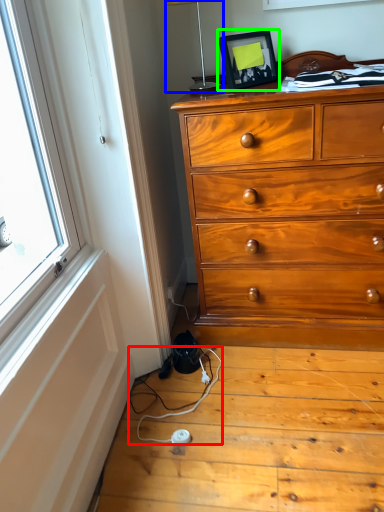
Question: Estimate the real-world distances between objects in this image. Which object is closer to twin (highlighted by a red box), table lamp (highlighted by a blue box) or picture frame (highlighted by a green box)?

Choices:
 (A) table lamp
 (B) picture frame

Answer: (B)